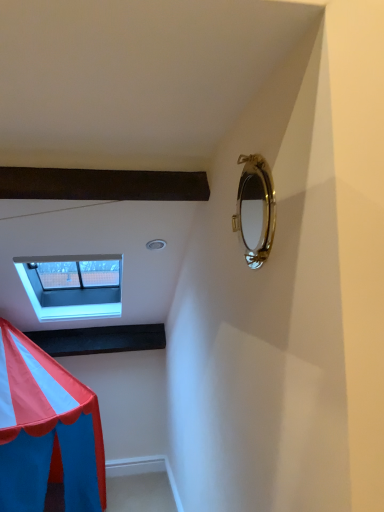
Question: Is point (264, 245) closer or farther from the camera than point (44, 316)?

Choices:
 (A) closer
 (B) farther

Answer: (A)

Question: Considering the positions of gold metallic mirror at upper right and white plastic window at upper left in the image, is gold metallic mirror at upper right taller or shorter than white plastic window at upper left?

Choices:
 (A) short
 (B) tall

Answer: (A)

Question: From the image's perspective, is gold metallic mirror at upper right located above or below white plastic window at upper left?

Choices:
 (A) above
 (B) below

Answer: (A)

Question: From the image's perspective, is white plastic window at upper left located above or below gold metallic mirror at upper right?

Choices:
 (A) below
 (B) above

Answer: (A)

Question: Is white plastic window at upper left wider or thinner than gold metallic mirror at upper right?

Choices:
 (A) wide
 (B) thin

Answer: (A)

Question: In terms of size, does white plastic window at upper left appear bigger or smaller than gold metallic mirror at upper right?

Choices:
 (A) small
 (B) big

Answer: (B)

Question: From a real-world perspective, relative to gold metallic mirror at upper right, is white plastic window at upper left vertically above or below?

Choices:
 (A) above
 (B) below

Answer: (B)